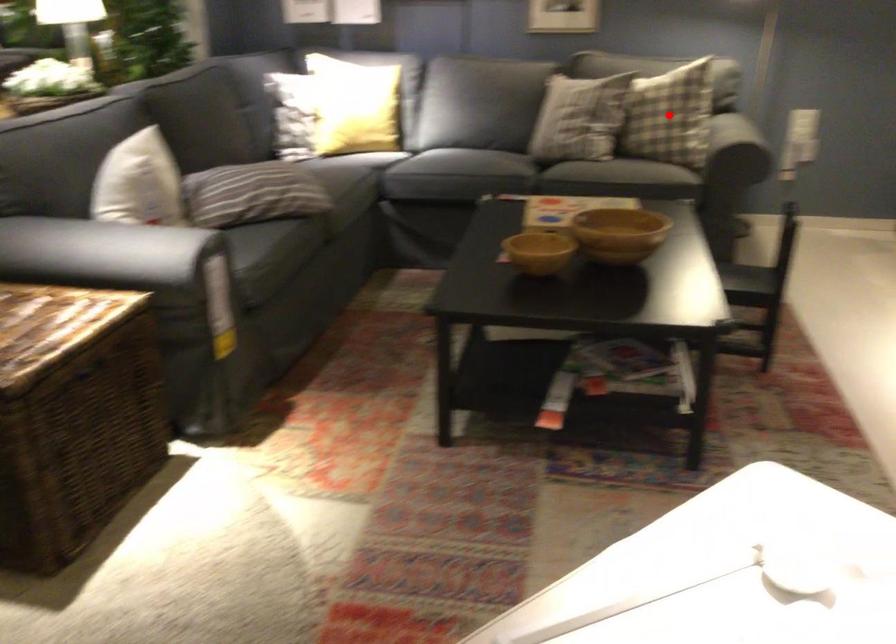
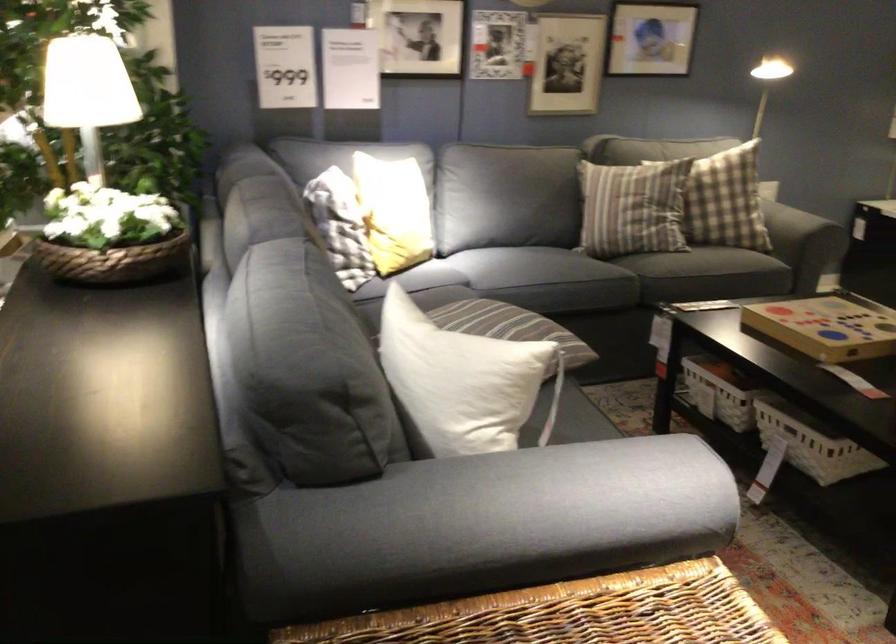
Question: I am providing you with two images of the same scene from different viewpoints. A red point is marked on the first image. Is the red point's position out of view in image 2?

Choices:
 (A) Yes
 (B) No

Answer: (A)